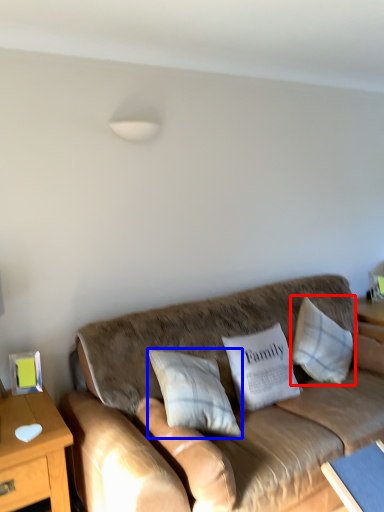
Question: Which point is further to the camera, pillow (highlighted by a red box) or pillow (highlighted by a blue box)?

Choices:
 (A) pillow
 (B) pillow

Answer: (A)